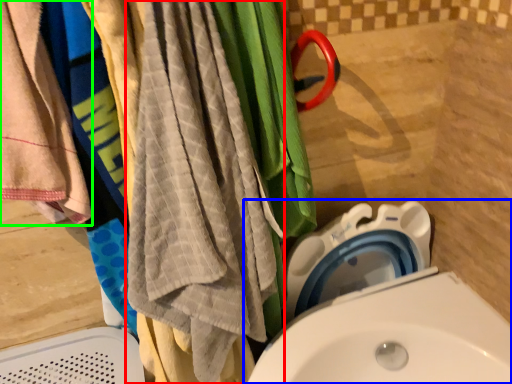
Question: Which object is the closest to the beach towel (highlighted by a red box)? Choose among these: toilet (highlighted by a blue box) or towel (highlighted by a green box).

Choices:
 (A) toilet
 (B) towel

Answer: (B)